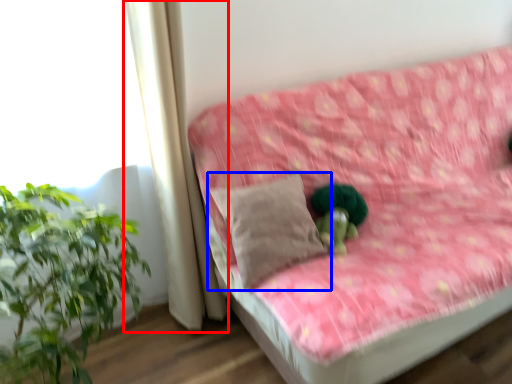
Question: Which point is further to the camera, curtain (highlighted by a red box) or pillow (highlighted by a blue box)?

Choices:
 (A) curtain
 (B) pillow

Answer: (B)